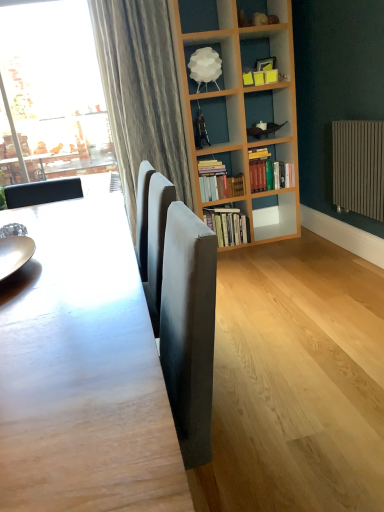
At what (x,y) coordinates should I click in order to perform the action: click on free space in front of hardcover books at center, the 3th book when ordered from top to bottom. Please return your answer as a coordinate pair (x, y). The height and width of the screenshot is (512, 384). Looking at the image, I should click on (242, 257).